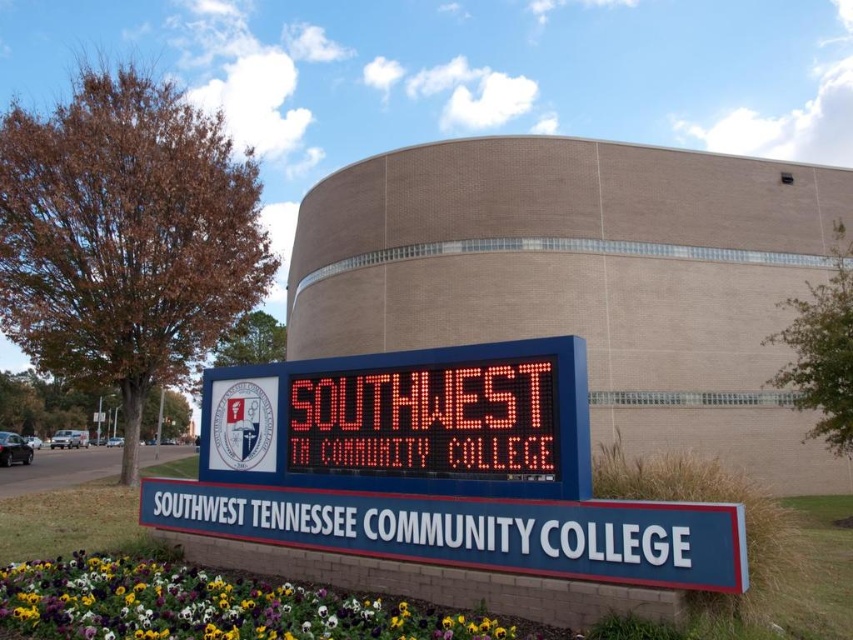
Is multicolored petals at lower center wider than led display at center?

Indeed, multicolored petals at lower center has a greater width compared to led display at center.

Is point (318, 588) positioned after point (517, 436)?

Yes, point (318, 588) is behind point (517, 436).

Image resolution: width=853 pixels, height=640 pixels. I want to click on multicolored petals at lower center, so click(x=206, y=605).